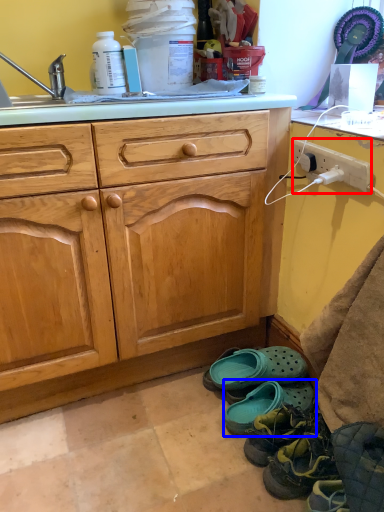
Question: Among these objects, which one is farthest to the camera, power outlet (highlighted by a red box) or footwear (highlighted by a blue box)?

Choices:
 (A) power outlet
 (B) footwear

Answer: (B)